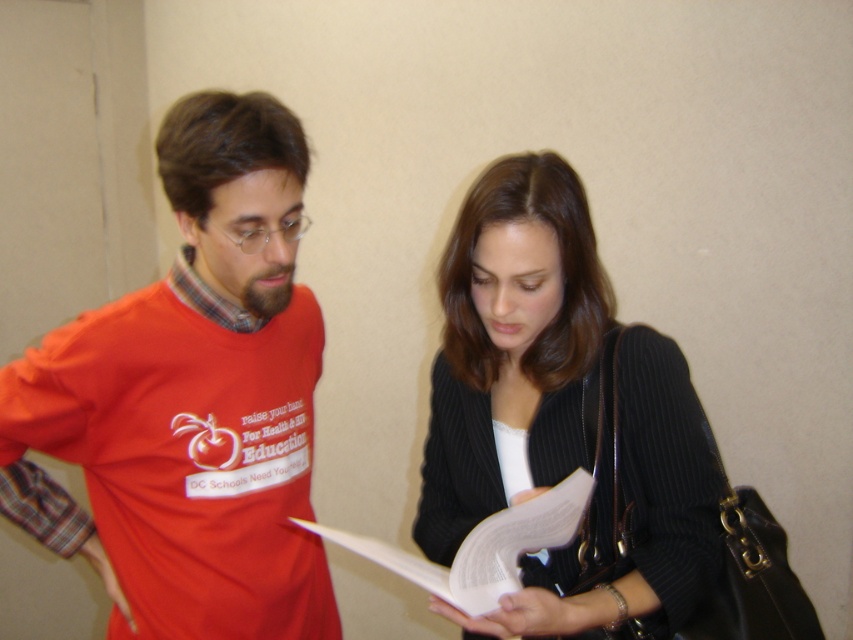
Question: Among these points, which one is nearest to the camera?

Choices:
 (A) (428, 564)
 (B) (451, 548)
 (C) (167, 404)

Answer: (A)

Question: Which of these objects is positioned closest to the black ribbed sweater at center?

Choices:
 (A) white paper at center
 (B) matte orange t-shirt at center

Answer: (A)

Question: Can you confirm if matte orange t-shirt at center is positioned to the right of white paper at center?

Choices:
 (A) no
 (B) yes

Answer: (A)

Question: Is black ribbed sweater at center to the right of white paper at center from the viewer's perspective?

Choices:
 (A) yes
 (B) no

Answer: (A)

Question: Is black ribbed sweater at center wider than white paper at center?

Choices:
 (A) no
 (B) yes

Answer: (B)

Question: Among these objects, which one is nearest to the camera?

Choices:
 (A) matte orange t-shirt at center
 (B) white paper at center
 (C) black ribbed sweater at center

Answer: (B)